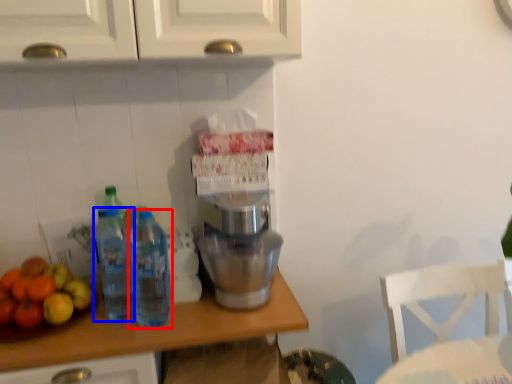
Question: Which object is closer to the camera taking this photo, bottle (highlighted by a red box) or bottle (highlighted by a blue box)?

Choices:
 (A) bottle
 (B) bottle

Answer: (A)